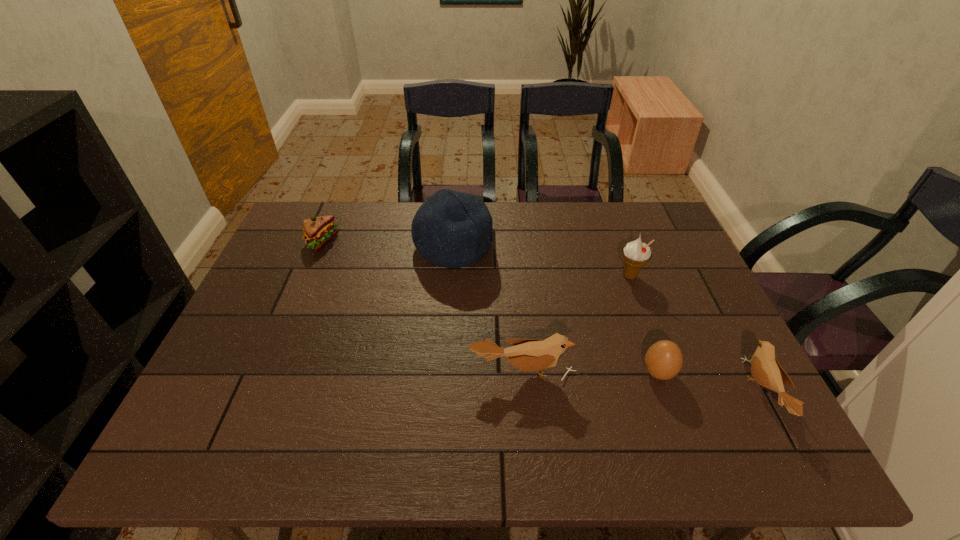
Where is `free space at the far edge of the desktop`? The image size is (960, 540). free space at the far edge of the desktop is located at coordinates (337, 236).

Where is `vacant space at the near edge of the desktop`? vacant space at the near edge of the desktop is located at coordinates (332, 399).

Identify the location of blank space at the left edge. This screenshot has width=960, height=540. (246, 376).

Find the location of a particular element. free region at the right edge of the desktop is located at coordinates (708, 341).

Find the location of a particular element. This screenshot has width=960, height=540. vacant space at the far left corner of the desktop is located at coordinates (295, 241).

This screenshot has height=540, width=960. Identify the location of vacant space at the near left corner of the desktop. (254, 416).

This screenshot has height=540, width=960. In order to click on free space between the third tallest object and the leftmost object in this screenshot , I will do `click(422, 307)`.

Identify the location of unoccupied area between the leftmost object and the skullcap. (387, 244).

You are a GUI agent. You are given a task and a screenshot of the screen. Output one action in this format:
    pyautogui.click(x=<x>, y=<y>)
    Task: Click on the free space between the taller bird and the shorter bird
    The width and height of the screenshot is (960, 540).
    Given the screenshot: What is the action you would take?
    pyautogui.click(x=642, y=382)

Locate an element on the screen. This screenshot has height=540, width=960. empty location between the tallest object and the icecream is located at coordinates (541, 261).